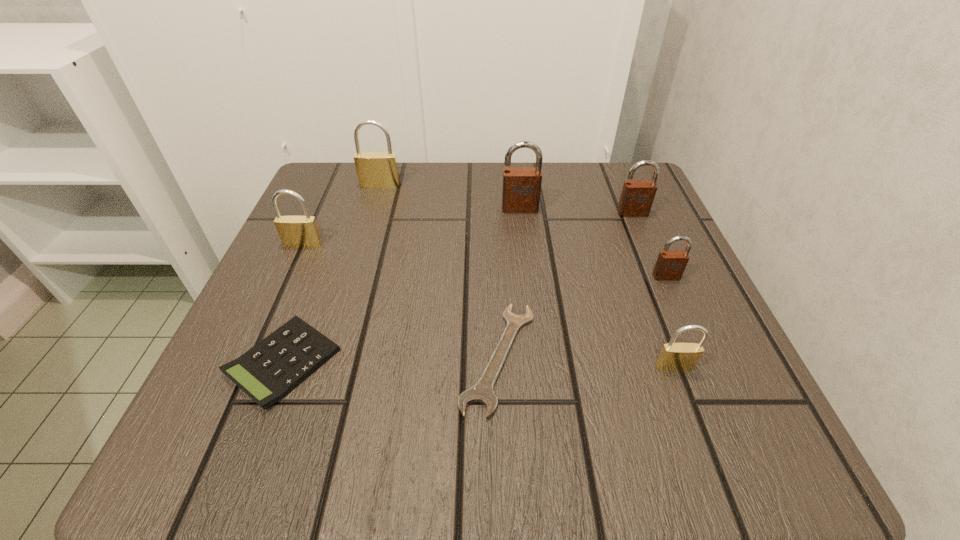
At what (x,y) coordinates should I click in order to perform the action: click on the second brass padlock from left to right. Please return your answer as a coordinate pair (x, y). The height and width of the screenshot is (540, 960). Looking at the image, I should click on (374, 169).

You are a GUI agent. You are given a task and a screenshot of the screen. Output one action in this format:
    pyautogui.click(x=<x>, y=<y>)
    Task: Click on the second padlock from left to right
    
    Given the screenshot: What is the action you would take?
    pyautogui.click(x=374, y=169)

At what (x,y) coordinates should I click in order to perform the action: click on the leftmost brown padlock. Please return your answer as a coordinate pair (x, y). Looking at the image, I should click on (521, 189).

The image size is (960, 540). In order to click on the biggest brown padlock in this screenshot , I will do `click(521, 189)`.

What are the coordinates of `the second biggest brown padlock` in the screenshot? It's located at (637, 196).

This screenshot has height=540, width=960. Identify the location of the second smallest brass padlock. [294, 231].

Identify the location of the leftmost padlock. The image size is (960, 540). (294, 231).

Find the location of a particular element. the nearest brass padlock is located at coordinates (674, 356).

This screenshot has height=540, width=960. I want to click on the rightmost brass padlock, so click(674, 356).

This screenshot has width=960, height=540. I want to click on the fifth farthest padlock, so click(670, 265).